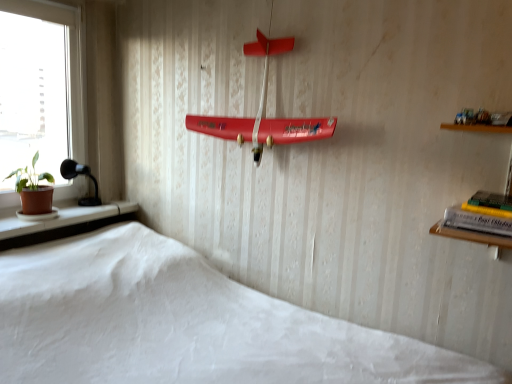
Question: Can you confirm if terracotta clay pot at left is bigger than white matte bed at lower center?

Choices:
 (A) yes
 (B) no

Answer: (B)

Question: From the image's perspective, is terracotta clay pot at left located beneath white matte bed at lower center?

Choices:
 (A) no
 (B) yes

Answer: (A)

Question: Does terracotta clay pot at left turn towards white matte bed at lower center?

Choices:
 (A) no
 (B) yes

Answer: (A)

Question: From a real-world perspective, is terracotta clay pot at left under white matte bed at lower center?

Choices:
 (A) yes
 (B) no

Answer: (B)

Question: Does terracotta clay pot at left have a greater height compared to white matte bed at lower center?

Choices:
 (A) no
 (B) yes

Answer: (A)

Question: Is terracotta clay pot at left looking in the opposite direction of white matte bed at lower center?

Choices:
 (A) yes
 (B) no

Answer: (B)

Question: Is terracotta clay pot at left looking in the opposite direction of hardcover book at right?

Choices:
 (A) yes
 (B) no

Answer: (B)

Question: Is terracotta clay pot at left further to the viewer compared to hardcover book at right?

Choices:
 (A) yes
 (B) no

Answer: (A)

Question: Is terracotta clay pot at left completely or partially outside of hardcover book at right?

Choices:
 (A) no
 (B) yes

Answer: (B)

Question: From a real-world perspective, is terracotta clay pot at left physically below hardcover book at right?

Choices:
 (A) yes
 (B) no

Answer: (A)

Question: From a real-world perspective, is terracotta clay pot at left positioned over hardcover book at right based on gravity?

Choices:
 (A) yes
 (B) no

Answer: (B)

Question: Can you confirm if terracotta clay pot at left is smaller than hardcover book at right?

Choices:
 (A) yes
 (B) no

Answer: (B)

Question: Is terracotta clay pot at left not within green matte houseplant at left?

Choices:
 (A) no
 (B) yes

Answer: (B)